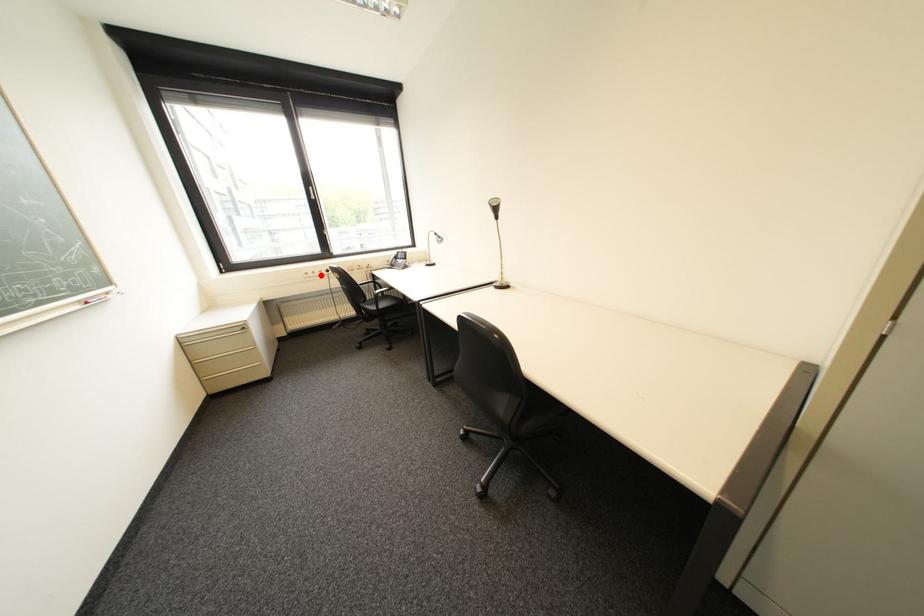
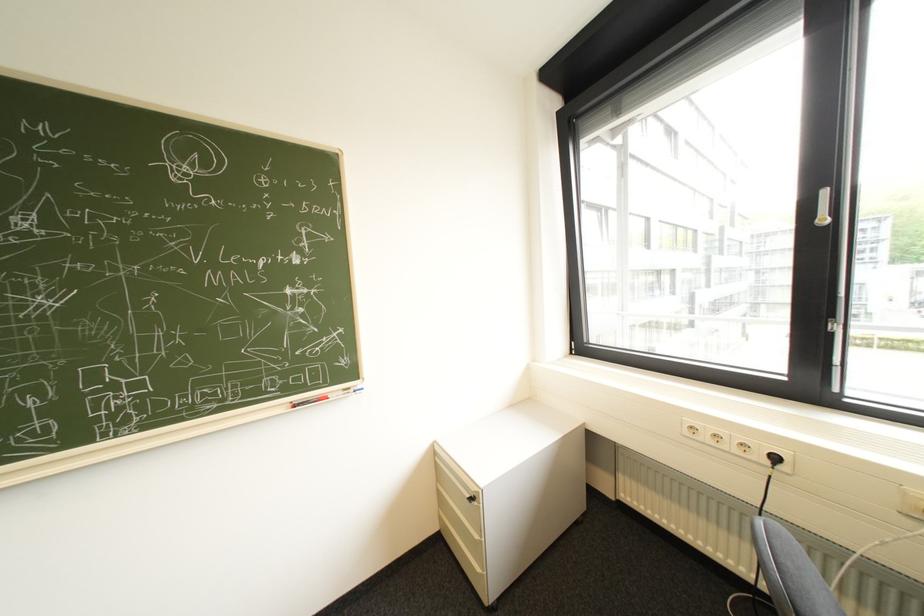
Find the pixel in the second image that matches the highlighted location in the first image.

(715, 438)